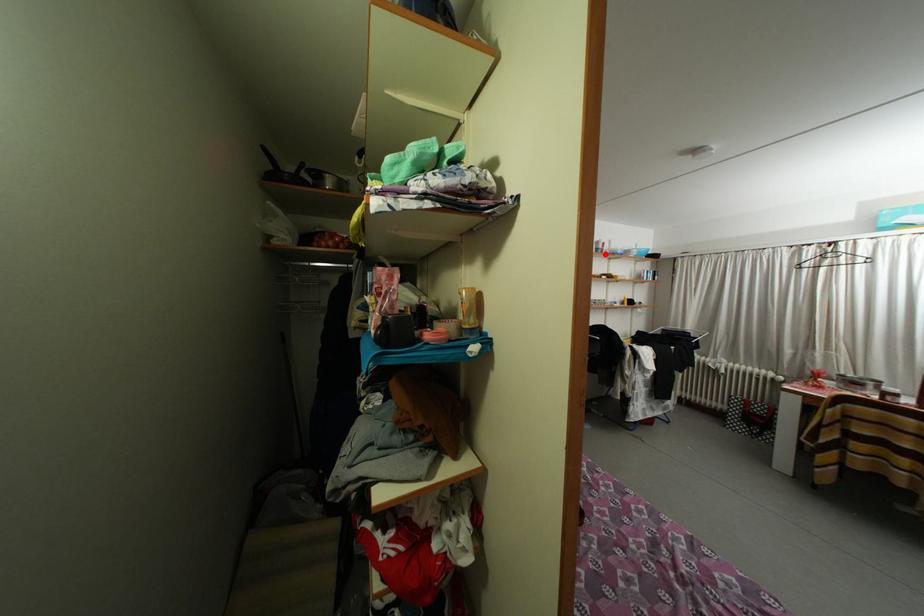
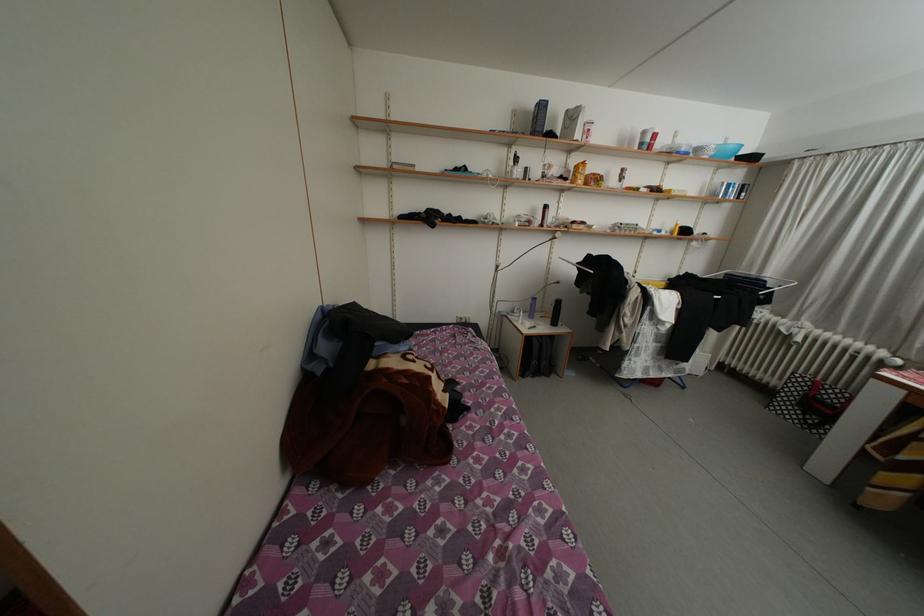
Locate, in the second image, the point that corresponds to the highlighted location in the first image.

(650, 148)